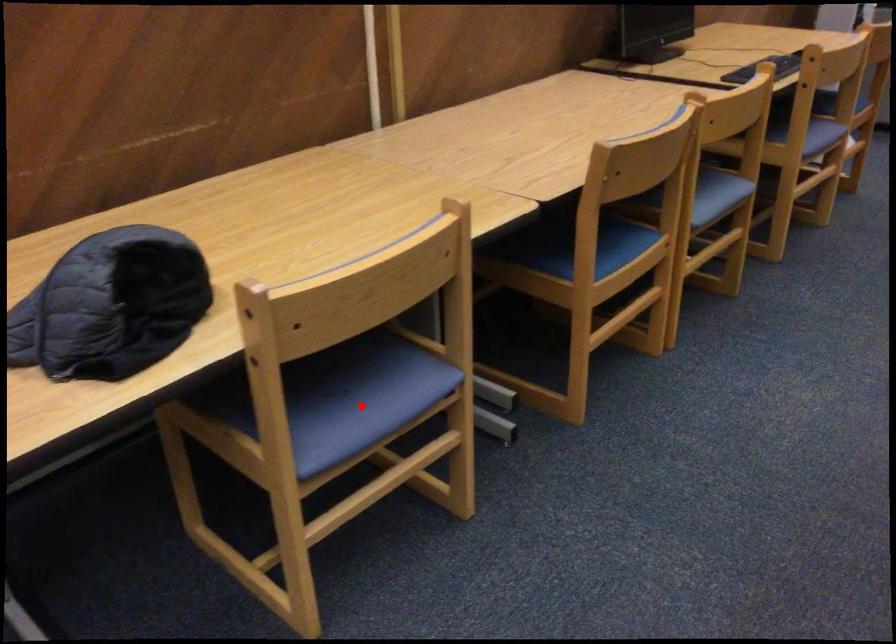
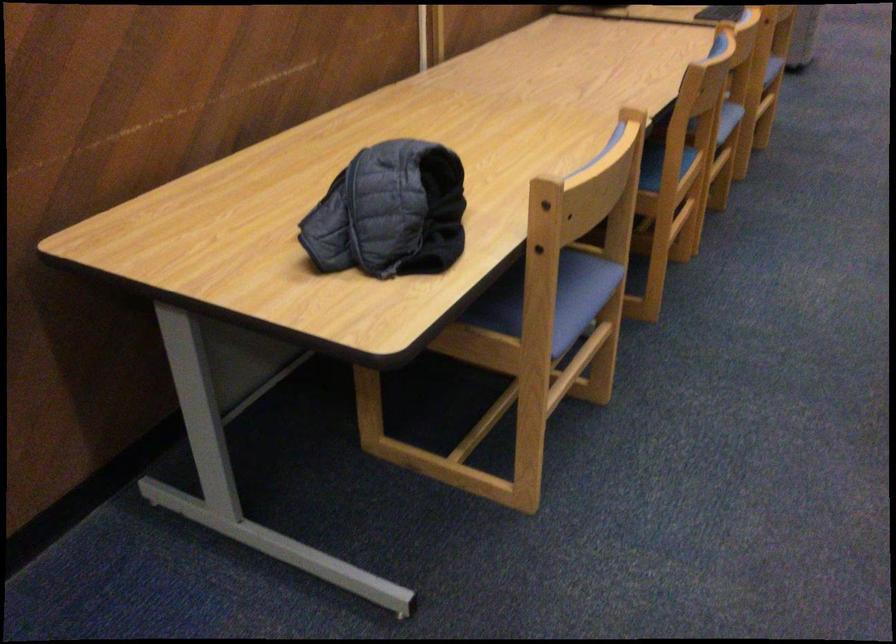
Question: I am providing you with two images of the same scene from different viewpoints. A red point is shown in image1. For the corresponding object point in image2, is it positioned nearer or farther from the camera?

Choices:
 (A) Nearer
 (B) Farther

Answer: (B)